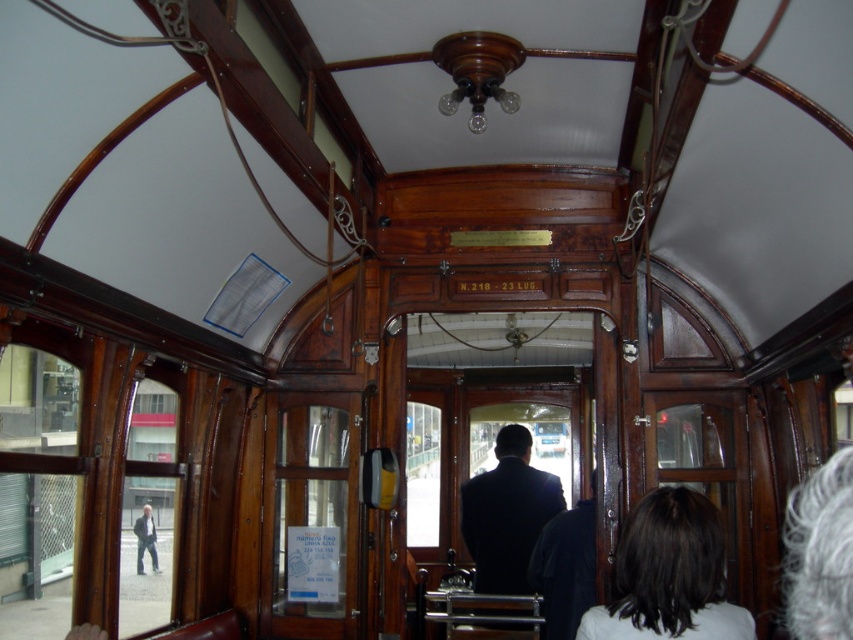
Question: Estimate the real-world distances between objects in this image. Which object is farther from the gray hair at upper right?

Choices:
 (A) dark suit coat at center
 (B) light gray fabric jacket at left

Answer: (B)

Question: Is dark brown hair at lower right smaller than gray hair at upper right?

Choices:
 (A) yes
 (B) no

Answer: (A)

Question: Estimate the real-world distances between objects in this image. Which object is farther from the dark suit coat at center?

Choices:
 (A) gray hair at upper right
 (B) dark brown hair at lower right

Answer: (B)

Question: Which of the following is the closest to the observer?

Choices:
 (A) (503, 582)
 (B) (148, 516)
 (C) (693, 593)

Answer: (C)

Question: Can you confirm if dark brown hair at lower right is positioned to the left of dark suit coat at center?

Choices:
 (A) no
 (B) yes

Answer: (A)

Question: Observing the image, what is the correct spatial positioning of dark brown hair at lower right in reference to light gray fabric jacket at left?

Choices:
 (A) below
 (B) above

Answer: (B)